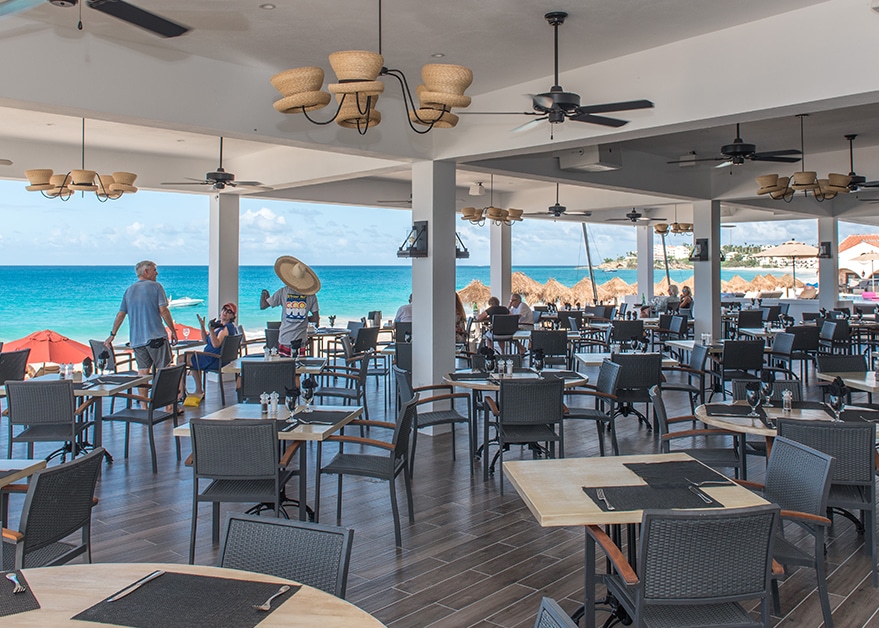
This screenshot has width=879, height=628. In order to click on table in this screenshot , I will do coord(555,494).